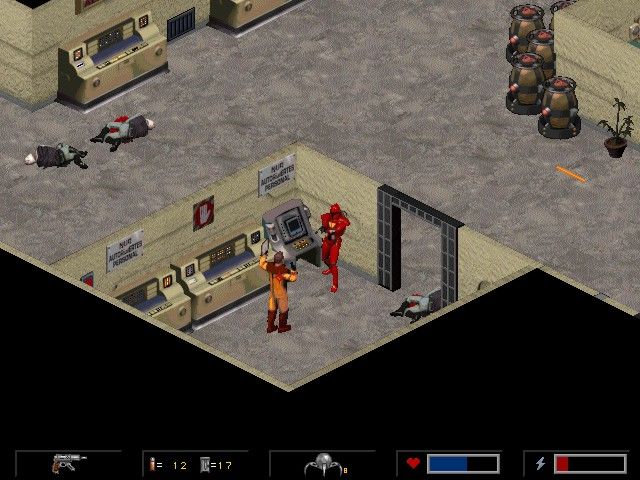
Identify the location of dead plant. (612, 146).